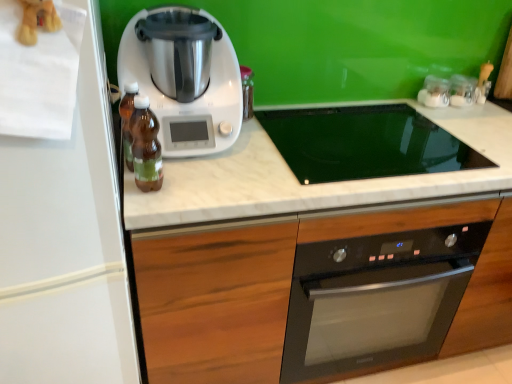
Question: From a real-world perspective, is brown glass bottle at center, the first bottle when ordered from front to back, located higher than white matte refrigerator at left?

Choices:
 (A) no
 (B) yes

Answer: (B)

Question: From a real-world perspective, is brown glass bottle at center, the first bottle when ordered from front to back, physically below white matte refrigerator at left?

Choices:
 (A) no
 (B) yes

Answer: (A)

Question: Does brown glass bottle at center, marked as the second bottle in a back-to-front arrangement, turn towards white matte refrigerator at left?

Choices:
 (A) yes
 (B) no

Answer: (B)

Question: Is brown glass bottle at center, marked as the second bottle in a back-to-front arrangement, positioned before white matte refrigerator at left?

Choices:
 (A) yes
 (B) no

Answer: (B)

Question: Is brown glass bottle at center, the first bottle when ordered from front to back, positioned behind white matte refrigerator at left?

Choices:
 (A) no
 (B) yes

Answer: (B)

Question: Is brown glass bottle at center, the first bottle when ordered from front to back, facing away from white matte refrigerator at left?

Choices:
 (A) yes
 (B) no

Answer: (A)

Question: Is brown glass bottle at center, the first bottle when ordered from front to back, to the left of clear glass jars at upper right, which ranks as the second appliance in left-to-right order, from the viewer's perspective?

Choices:
 (A) yes
 (B) no

Answer: (A)

Question: Are brown glass bottle at center, the first bottle when ordered from front to back, and clear glass jars at upper right, marked as the first appliance in a right-to-left arrangement, beside each other?

Choices:
 (A) no
 (B) yes

Answer: (A)

Question: Does brown glass bottle at center, marked as the second bottle in a back-to-front arrangement, have a greater height compared to clear glass jars at upper right, marked as the first appliance in a right-to-left arrangement?

Choices:
 (A) yes
 (B) no

Answer: (A)

Question: Can you confirm if brown glass bottle at center, marked as the second bottle in a back-to-front arrangement, is bigger than clear glass jars at upper right, which ranks as the second appliance in left-to-right order?

Choices:
 (A) yes
 (B) no

Answer: (A)

Question: Does brown glass bottle at center, the first bottle when ordered from front to back, appear on the right side of clear glass jars at upper right, marked as the first appliance in a right-to-left arrangement?

Choices:
 (A) yes
 (B) no

Answer: (B)

Question: From a real-world perspective, is brown glass bottle at center, marked as the second bottle in a back-to-front arrangement, beneath clear glass jars at upper right, which ranks as the second appliance in left-to-right order?

Choices:
 (A) no
 (B) yes

Answer: (A)

Question: Is white marble countertop at center not within white plastic kitchen appliance at center?

Choices:
 (A) yes
 (B) no

Answer: (A)